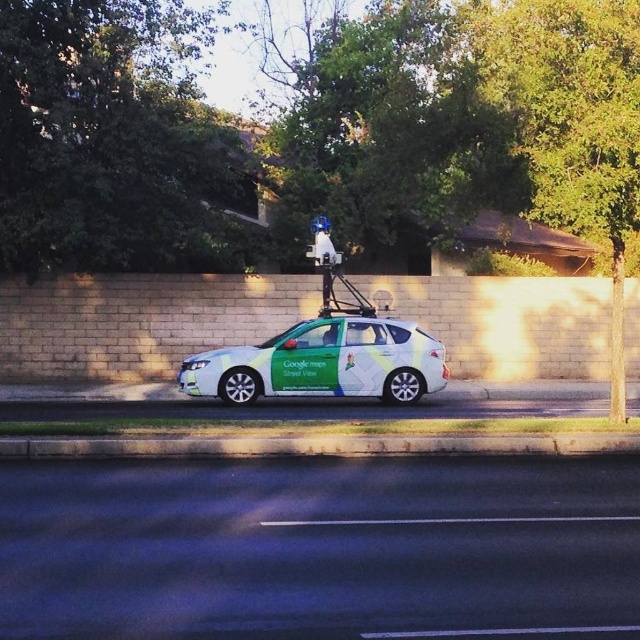
You are a delivery person who needs to park your van 100 feet away from the green glossy car at center. The parking spot you found is 65.59 feet away from it. Is this parking spot too close?

The parking spot is 65.59 feet away from the green glossy car at center, which is less than the required 100 feet. Therefore, this parking spot is too close.